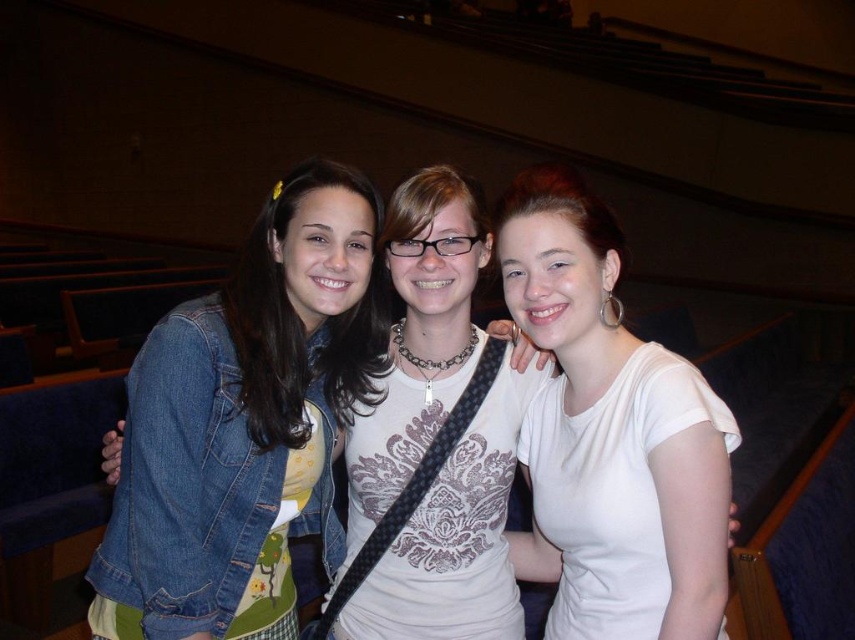
Question: Among these objects, which one is farthest from the camera?

Choices:
 (A) white matte shirt at center
 (B) denim jacket at center
 (C) denim jacket at left

Answer: (B)

Question: Is white matte shirt at center thinner than denim jacket at center?

Choices:
 (A) no
 (B) yes

Answer: (B)

Question: Is the position of denim jacket at left less distant than that of denim jacket at center?

Choices:
 (A) no
 (B) yes

Answer: (B)

Question: Does white matte shirt at center have a lesser width compared to denim jacket at center?

Choices:
 (A) yes
 (B) no

Answer: (A)

Question: Which object appears farthest from the camera in this image?

Choices:
 (A) denim jacket at center
 (B) denim jacket at left

Answer: (A)

Question: Which object is positioned closest to the denim jacket at left?

Choices:
 (A) denim jacket at center
 (B) white matte shirt at center

Answer: (A)